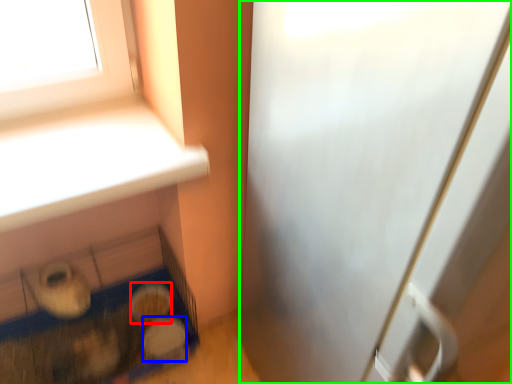
Question: Considering the real-world distances, which object is closest to food (highlighted by a red box)? food (highlighted by a blue box) or screen door (highlighted by a green box).

Choices:
 (A) food
 (B) screen door

Answer: (A)